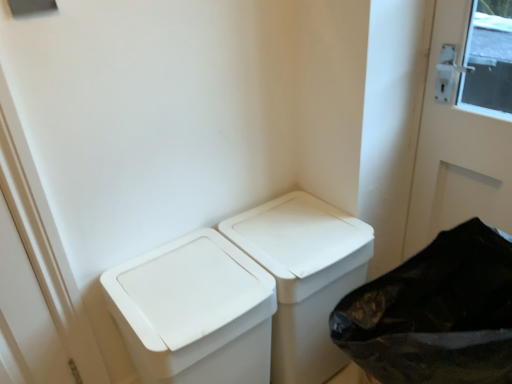
Question: Is white plastic waste container at center, the second waste container viewed from the right, wider or thinner than white plastic waste container at center, which ranks as the first waste container in right-to-left order?

Choices:
 (A) thin
 (B) wide

Answer: (B)

Question: Is point coord(205,289) closer or farther from the camera than point coord(306,334)?

Choices:
 (A) closer
 (B) farther

Answer: (A)

Question: Estimate the real-world distances between objects in this image. Which object is closer to the white plastic waste container at center, which is the 2th waste container from left to right?

Choices:
 (A) white plastic recycling bin at lower right
 (B) white plastic waste container at center, the first waste container positioned from the left

Answer: (B)

Question: Considering the real-world distances, which object is farthest from the white plastic recycling bin at lower right?

Choices:
 (A) white plastic waste container at center, the first waste container positioned from the left
 (B) white plastic waste container at center, which ranks as the first waste container in right-to-left order

Answer: (A)